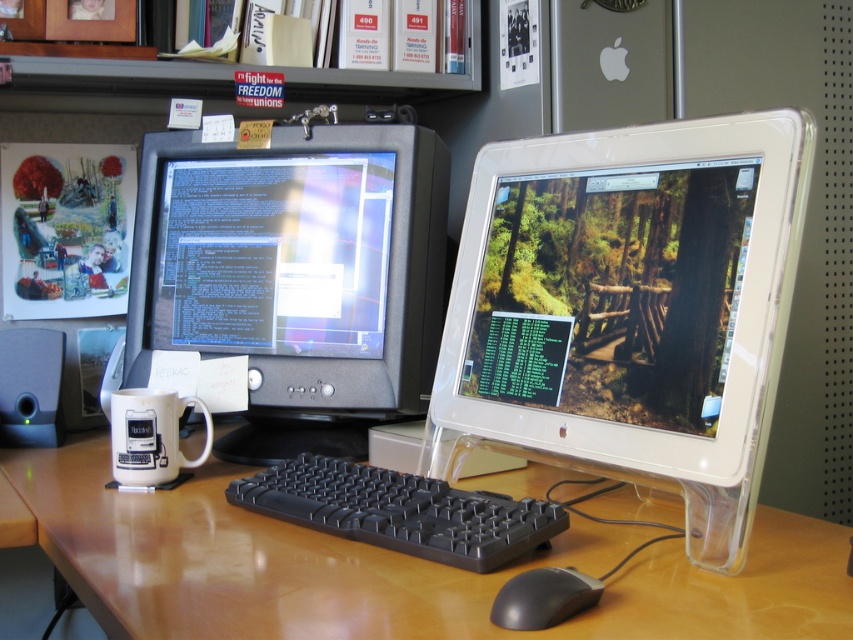
You are sitting at the brown wood computer desk at center and want to grab the white ceramic mug at lower left. Can you reach it without moving your chair?

The brown wood computer desk at center is closer to the viewer than the white ceramic mug at lower left, so the mug is farther away. You might need to move your chair closer to reach it.

You are a technician trying to locate a specific point on the desk. The point is marked at coordinates (631, 307). Which object on the desk does this point correspond to?

The point corresponds to the white plastic monitor at center.

You are organizing the desk and want to place a new object between the matte black monitor at left and the white ceramic mug at lower left. Based on their positions, which object should be closer to you when placing the new item?

The matte black monitor at left is closer to you than the white ceramic mug at lower left, so the new object should be placed closer to the matte black monitor at left.